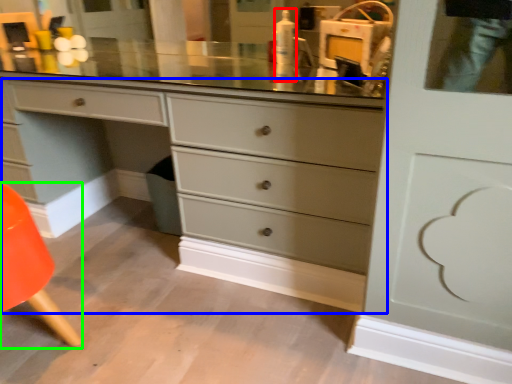
Question: Based on their relative distances, which object is nearer to toiletry (highlighted by a red box)? Choose from chest of drawers (highlighted by a blue box) and armchair (highlighted by a green box).

Choices:
 (A) chest of drawers
 (B) armchair

Answer: (A)